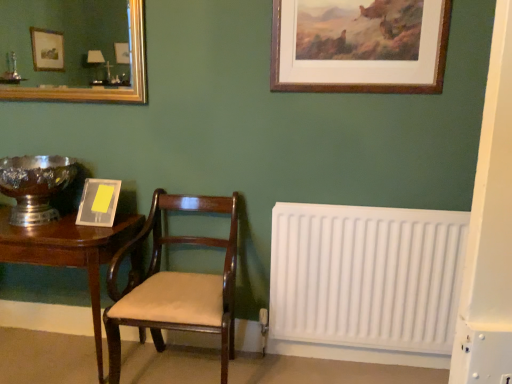
Question: From a real-world perspective, is shiny silver bowl at left located higher than mahogany wood chair at center?

Choices:
 (A) yes
 (B) no

Answer: (A)

Question: Is mahogany wood chair at center a part of shiny silver bowl at left?

Choices:
 (A) yes
 (B) no

Answer: (B)

Question: From a real-world perspective, does shiny silver bowl at left sit lower than mahogany wood chair at center?

Choices:
 (A) no
 (B) yes

Answer: (A)

Question: Is shiny silver bowl at left further to camera compared to mahogany wood chair at center?

Choices:
 (A) yes
 (B) no

Answer: (A)

Question: From the image's perspective, does shiny silver bowl at left appear lower than mahogany wood chair at center?

Choices:
 (A) no
 (B) yes

Answer: (A)

Question: In terms of size, does matte gray picture frame at left, the second picture frame viewed from the right, appear bigger or smaller than white plastic radiator at lower right?

Choices:
 (A) small
 (B) big

Answer: (A)

Question: In terms of height, does matte gray picture frame at left, which ranks as the second picture frame in top-to-bottom order, look taller or shorter compared to white plastic radiator at lower right?

Choices:
 (A) tall
 (B) short

Answer: (B)

Question: Does point (108, 193) appear closer or farther from the camera than point (372, 231)?

Choices:
 (A) farther
 (B) closer

Answer: (A)

Question: From the image's perspective, relative to white plastic radiator at lower right, is matte gray picture frame at left, the second picture frame viewed from the right, above or below?

Choices:
 (A) below
 (B) above

Answer: (B)

Question: Does point (90, 218) appear closer or farther from the camera than point (123, 97)?

Choices:
 (A) farther
 (B) closer

Answer: (B)

Question: In terms of width, does matte gray picture frame at left, which ranks as the second picture frame in top-to-bottom order, look wider or thinner when compared to gold-framed mirror at upper left?

Choices:
 (A) wide
 (B) thin

Answer: (A)

Question: Visually, is matte gray picture frame at left, the first picture frame positioned from the bottom, positioned to the left or to the right of gold-framed mirror at upper left?

Choices:
 (A) right
 (B) left

Answer: (A)

Question: Based on their sizes in the image, would you say matte gray picture frame at left, the second picture frame viewed from the right, is bigger or smaller than gold-framed mirror at upper left?

Choices:
 (A) big
 (B) small

Answer: (B)

Question: Considering the positions of shiny silver bowl at left and white plastic radiator at lower right in the image, is shiny silver bowl at left wider or thinner than white plastic radiator at lower right?

Choices:
 (A) wide
 (B) thin

Answer: (A)

Question: From a real-world perspective, relative to white plastic radiator at lower right, is shiny silver bowl at left vertically above or below?

Choices:
 (A) above
 (B) below

Answer: (A)